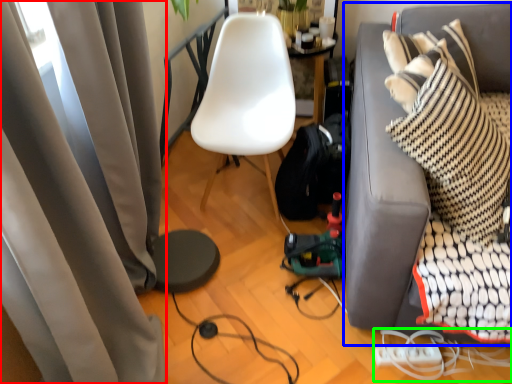
Question: Which is nearer to the curtain (highlighted by a red box)? studio couch (highlighted by a blue box) or cable (highlighted by a green box).

Choices:
 (A) studio couch
 (B) cable

Answer: (A)